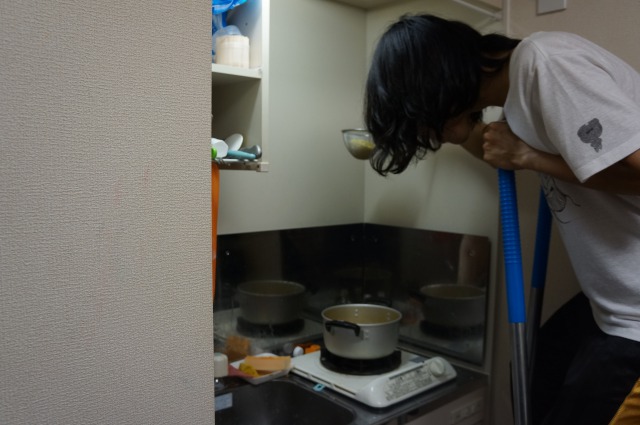
Identify the location of sink basin. (281, 396).